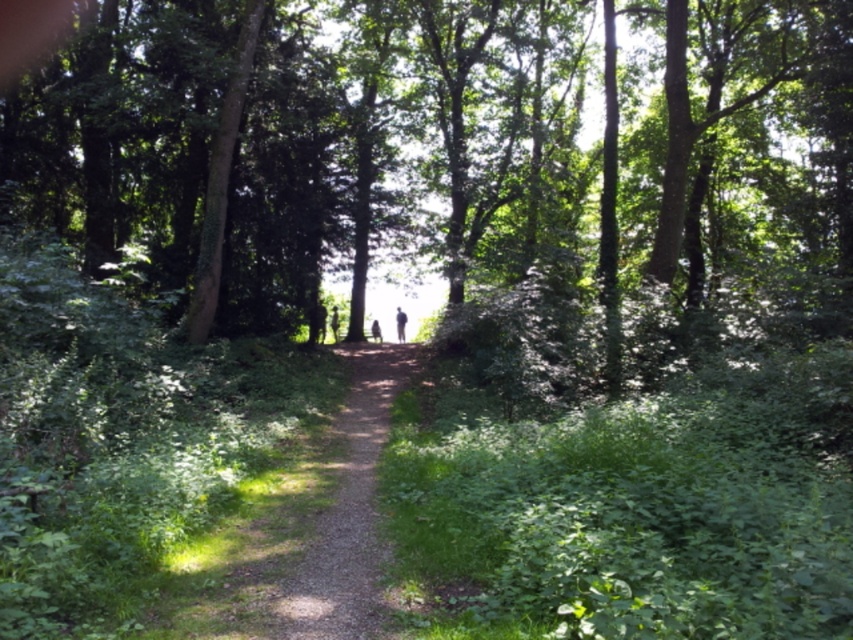
Question: Considering the real-world distances, which object is closest to the dirt path at center?

Choices:
 (A) silhouette figure at center
 (B) dark brown leather jacket at center
 (C) blurred figure at center

Answer: (B)

Question: Does blurred figure at center have a lesser width compared to dark brown leather jacket at center?

Choices:
 (A) yes
 (B) no

Answer: (A)

Question: Which point is farther to the camera?

Choices:
 (A) (376, 320)
 (B) (332, 310)

Answer: (A)

Question: Does dirt path at center have a lesser width compared to silhouette figure at center?

Choices:
 (A) yes
 (B) no

Answer: (B)

Question: Which point is farther to the camera?

Choices:
 (A) (399, 317)
 (B) (334, 314)
 (C) (387, 396)

Answer: (B)

Question: Can you confirm if dirt path at center is wider than silhouette figure at center?

Choices:
 (A) no
 (B) yes

Answer: (B)